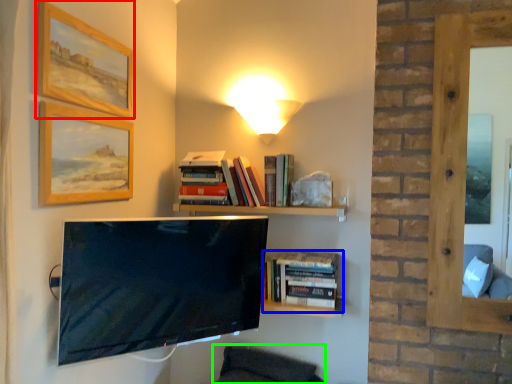
Question: Which object is the farthest from picture frame (highlighted by a red box)? Choose among these: book (highlighted by a blue box) or swivel chair (highlighted by a green box).

Choices:
 (A) book
 (B) swivel chair

Answer: (B)